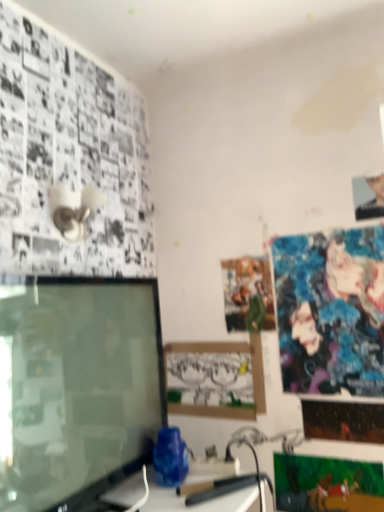
Question: Is point (355, 197) closer or farther from the camera than point (195, 356)?

Choices:
 (A) closer
 (B) farther

Answer: (A)

Question: Based on their sizes in the image, would you say smooth skin portrait at upper right is bigger or smaller than matte cardboard picture frame at center?

Choices:
 (A) small
 (B) big

Answer: (A)

Question: Considering the real-world distances, which object is closest to the shiny metallic poster at lower right, which is the 2th poster page in bottom-to-top order?

Choices:
 (A) matte cardboard picture frame at center
 (B) smooth skin portrait at upper right
 (C) matte paper poster at center, which ranks as the first poster page in top-to-bottom order
 (D) shiny blue fabric poster at upper right, the second poster page in the top-to-bottom sequence
 (E) matte green paper at lower right, which is the fourth poster page from top to bottom

Answer: (E)

Question: Which object is positioned closest to the shiny blue fabric poster at upper right, the 3th poster page in the bottom-to-top sequence?

Choices:
 (A) matte black monitor at left
 (B) matte cardboard picture frame at center
 (C) shiny metallic poster at lower right, the 3th poster page from the top
 (D) matte paper poster at center, which ranks as the first poster page in top-to-bottom order
 (E) smooth skin portrait at upper right

Answer: (D)